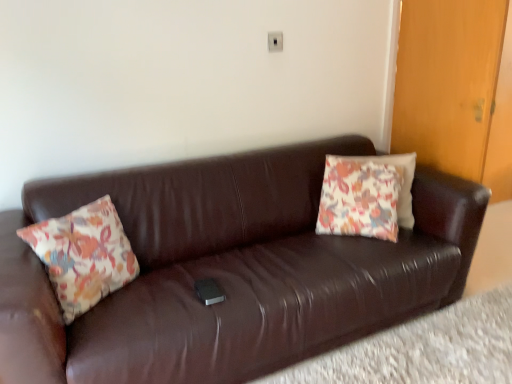
Question: Does wooden door at right turn towards brown leather couch at center?

Choices:
 (A) yes
 (B) no

Answer: (B)

Question: Does wooden door at right contain brown leather couch at center?

Choices:
 (A) yes
 (B) no

Answer: (B)

Question: Is wooden door at right positioned beyond the bounds of brown leather couch at center?

Choices:
 (A) no
 (B) yes

Answer: (B)

Question: Would you consider wooden door at right to be distant from brown leather couch at center?

Choices:
 (A) yes
 (B) no

Answer: (B)

Question: Is wooden door at right thinner than brown leather couch at center?

Choices:
 (A) no
 (B) yes

Answer: (B)

Question: In the image, is white plastic electric outlet at upper center on the left side or the right side of wooden door at right?

Choices:
 (A) right
 (B) left

Answer: (B)

Question: In terms of size, does white plastic electric outlet at upper center appear bigger or smaller than wooden door at right?

Choices:
 (A) big
 (B) small

Answer: (B)

Question: From a real-world perspective, is white plastic electric outlet at upper center above or below wooden door at right?

Choices:
 (A) below
 (B) above

Answer: (B)

Question: Is white plastic electric outlet at upper center in front of or behind wooden door at right in the image?

Choices:
 (A) front
 (B) behind

Answer: (B)

Question: Is floral fabric pillow at left, arranged as the 1th pillow when viewed from the front, inside the boundaries of brown leather couch at lower center, or outside?

Choices:
 (A) inside
 (B) outside

Answer: (B)

Question: Looking at their shapes, would you say floral fabric pillow at left, the second pillow from the right, is wider or thinner than brown leather couch at lower center?

Choices:
 (A) thin
 (B) wide

Answer: (A)

Question: In the image, is floral fabric pillow at left, acting as the first pillow starting from the left, positioned in front of or behind brown leather couch at lower center?

Choices:
 (A) behind
 (B) front

Answer: (A)

Question: Based on their sizes in the image, would you say floral fabric pillow at left, arranged as the 1th pillow when viewed from the front, is bigger or smaller than brown leather couch at lower center?

Choices:
 (A) small
 (B) big

Answer: (A)

Question: Is brown leather couch at lower center wider or thinner than floral fabric pillow at left, which is counted as the 2th pillow, starting from the back?

Choices:
 (A) thin
 (B) wide

Answer: (B)

Question: Looking at the image, does brown leather couch at lower center seem bigger or smaller compared to floral fabric pillow at left, arranged as the 1th pillow when viewed from the front?

Choices:
 (A) big
 (B) small

Answer: (A)